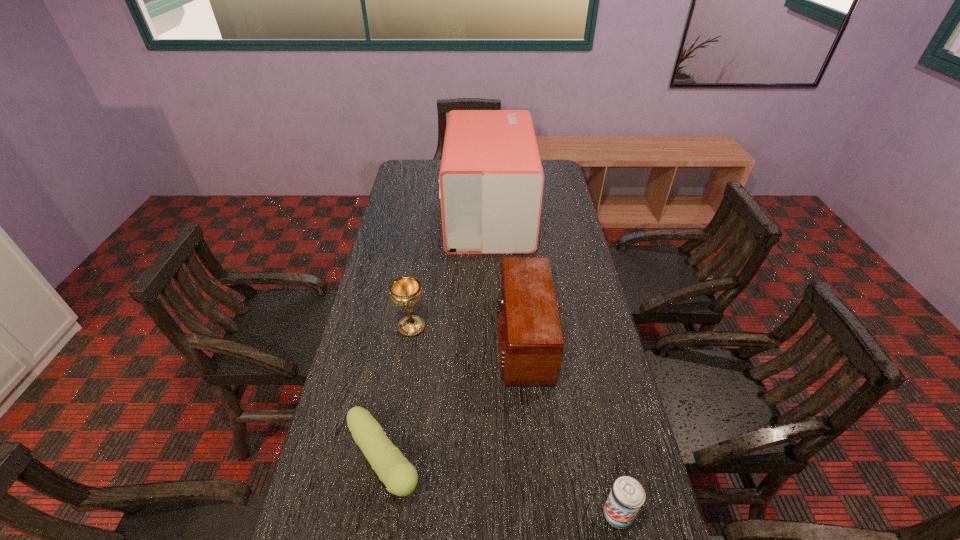
At what (x,y) coordinates should I click in order to perform the action: click on box. Please return your answer as a coordinate pair (x, y). Image resolution: width=960 pixels, height=540 pixels. Looking at the image, I should click on (491, 179).

The width and height of the screenshot is (960, 540). Identify the location of the farthest object. (491, 179).

In order to click on radio receiver in this screenshot , I will do `click(531, 345)`.

Locate an element on the screen. This screenshot has width=960, height=540. chalice is located at coordinates (406, 291).

Identify the location of the fourth tallest object. The width and height of the screenshot is (960, 540). (627, 495).

Where is `the rightmost object`? The image size is (960, 540). the rightmost object is located at coordinates (627, 495).

At what (x,y) coordinates should I click in order to perform the action: click on cucumber. Please return your answer as a coordinate pair (x, y). This screenshot has width=960, height=540. Looking at the image, I should click on (400, 477).

Find the location of a particular element. This screenshot has height=540, width=960. free space located on the surface of the box where the text is embossed is located at coordinates pos(396,215).

Where is `vacant space situated on the surface of the box where the text is embossed`? Image resolution: width=960 pixels, height=540 pixels. vacant space situated on the surface of the box where the text is embossed is located at coordinates (390, 215).

Find the location of a particular element. free spot located on the surface of the box where the text is embossed is located at coordinates (399, 215).